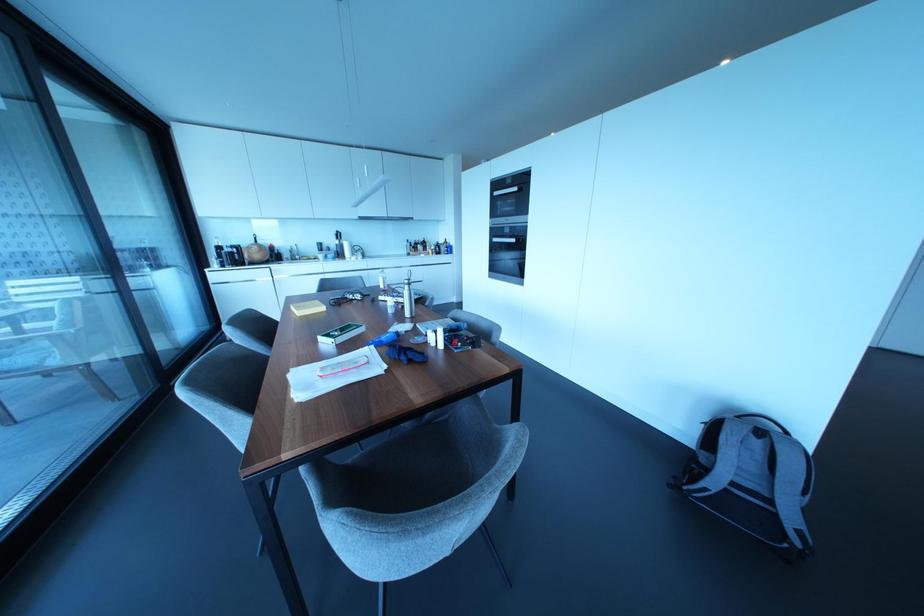
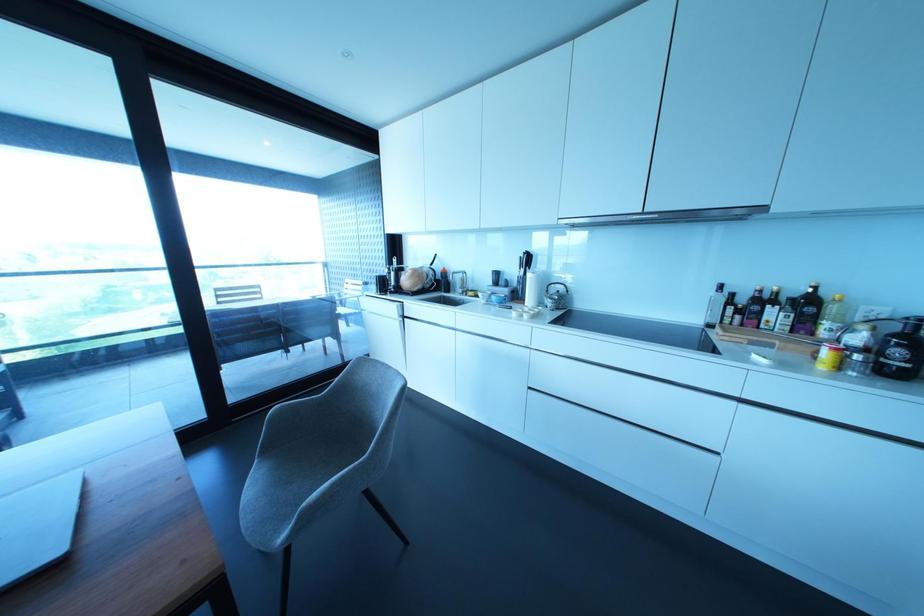
In the second image, find the point that corresponds to pixel 423 243 in the first image.

(807, 304)